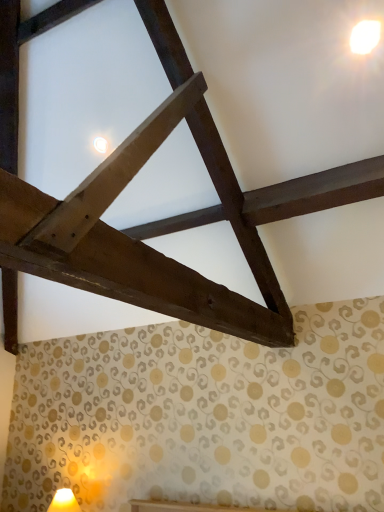
Question: Is point (69, 488) positioned closer to the camera than point (359, 22)?

Choices:
 (A) farther
 (B) closer

Answer: (A)

Question: From their relative heights in the image, would you say matte yellow table lamp at lower left is taller or shorter than white glossy light at upper right?

Choices:
 (A) tall
 (B) short

Answer: (A)

Question: Do you think matte yellow table lamp at lower left is within white glossy light at upper right, or outside of it?

Choices:
 (A) outside
 (B) inside

Answer: (A)

Question: From their relative heights in the image, would you say white glossy light at upper right is taller or shorter than matte yellow table lamp at lower left?

Choices:
 (A) tall
 (B) short

Answer: (B)

Question: Considering their positions, is white glossy light at upper right located in front of or behind matte yellow table lamp at lower left?

Choices:
 (A) front
 (B) behind

Answer: (A)

Question: Does point (375, 36) appear closer or farther from the camera than point (74, 506)?

Choices:
 (A) closer
 (B) farther

Answer: (A)

Question: From the image's perspective, is white glossy light at upper right located above or below matte yellow table lamp at lower left?

Choices:
 (A) above
 (B) below

Answer: (A)